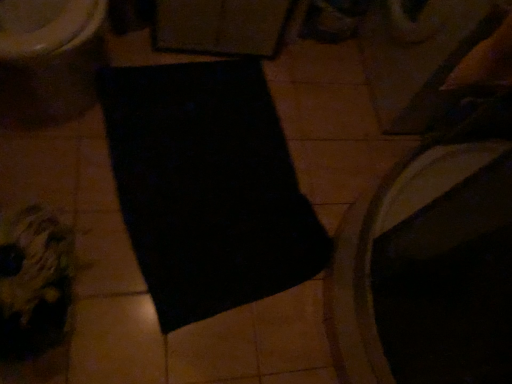
Question: Is matte white toilet at upper left in front of black matte yoga mat at center?

Choices:
 (A) no
 (B) yes

Answer: (B)

Question: Does matte white toilet at upper left have a lesser width compared to black matte yoga mat at center?

Choices:
 (A) no
 (B) yes

Answer: (B)

Question: From a real-world perspective, is matte white toilet at upper left over black matte yoga mat at center?

Choices:
 (A) no
 (B) yes

Answer: (B)

Question: Would you say black matte yoga mat at center is part of matte white toilet at upper left's contents?

Choices:
 (A) yes
 (B) no

Answer: (B)

Question: From a real-world perspective, is matte white toilet at upper left below black matte yoga mat at center?

Choices:
 (A) yes
 (B) no

Answer: (B)

Question: Is matte white toilet at upper left bigger than black matte yoga mat at center?

Choices:
 (A) yes
 (B) no

Answer: (A)

Question: From a real-world perspective, is black matte yoga mat at center located beneath matte white toilet at upper left?

Choices:
 (A) no
 (B) yes

Answer: (B)

Question: Considering the relative sizes of black matte yoga mat at center and matte white toilet at upper left in the image provided, is black matte yoga mat at center shorter than matte white toilet at upper left?

Choices:
 (A) no
 (B) yes

Answer: (B)

Question: Is black matte yoga mat at center bigger than matte white toilet at upper left?

Choices:
 (A) yes
 (B) no

Answer: (B)

Question: From the image's perspective, would you say black matte yoga mat at center is positioned over matte white toilet at upper left?

Choices:
 (A) no
 (B) yes

Answer: (A)

Question: Is black matte yoga mat at center in front of matte white toilet at upper left?

Choices:
 (A) yes
 (B) no

Answer: (B)

Question: Is black matte yoga mat at center thinner than matte white toilet at upper left?

Choices:
 (A) yes
 (B) no

Answer: (B)

Question: In terms of height, does black matte yoga mat at center look taller or shorter compared to matte white toilet at upper left?

Choices:
 (A) short
 (B) tall

Answer: (A)